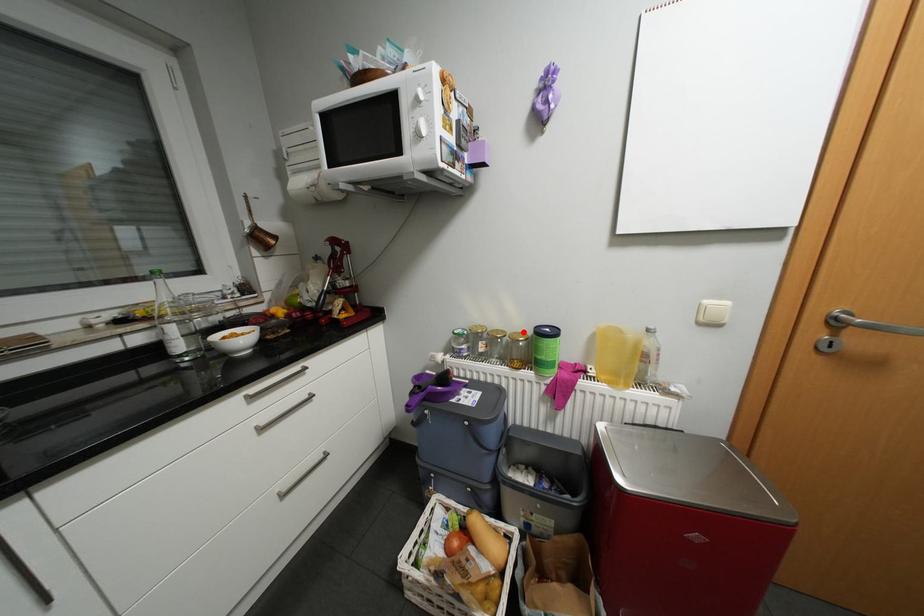
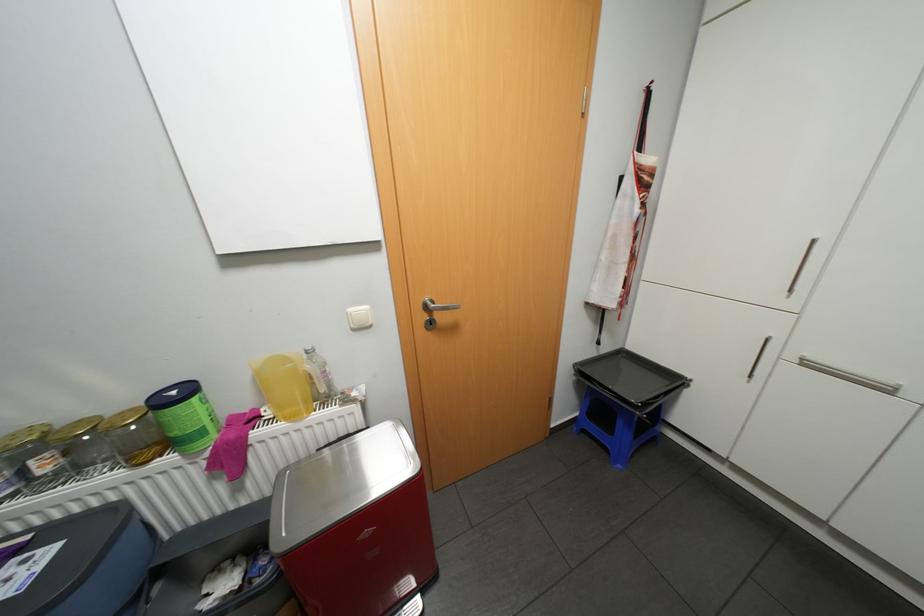
Locate, in the second image, the point that corresponds to the highlighted location in the first image.

(128, 411)